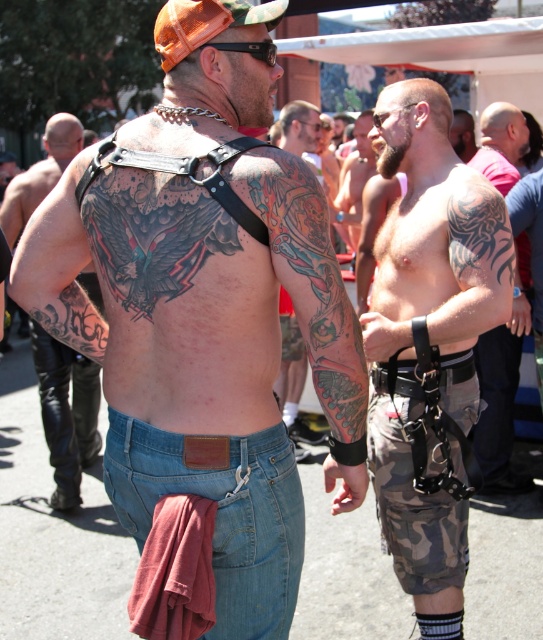
You are a photographer at the event and need to capture both the denim shorts at center and the black leather belt at lower right in a single frame. Which object should you focus on first to ensure both are in the shot?

The denim shorts at center is larger in size than the black leather belt at lower right, so focusing on the denim shorts at center first will help ensure both objects are captured in the frame.

Based on the scene description, can you determine the spatial relationship between the black leather belt at upper center and the black ink tattoo at lower left?

The black leather belt at upper center is located below the black ink tattoo at lower left.

You are a photographer standing at the scene. You want to take a closeup photo of the dark brown leather belt at right without moving the subject. Can you get a clear shot of it from your current position?

The dark brown leather belt at right is 13.97 feet away from viewer. Since it is more than 10 feet away, you might need a zoom lens to capture a clear closeup without moving the subject.